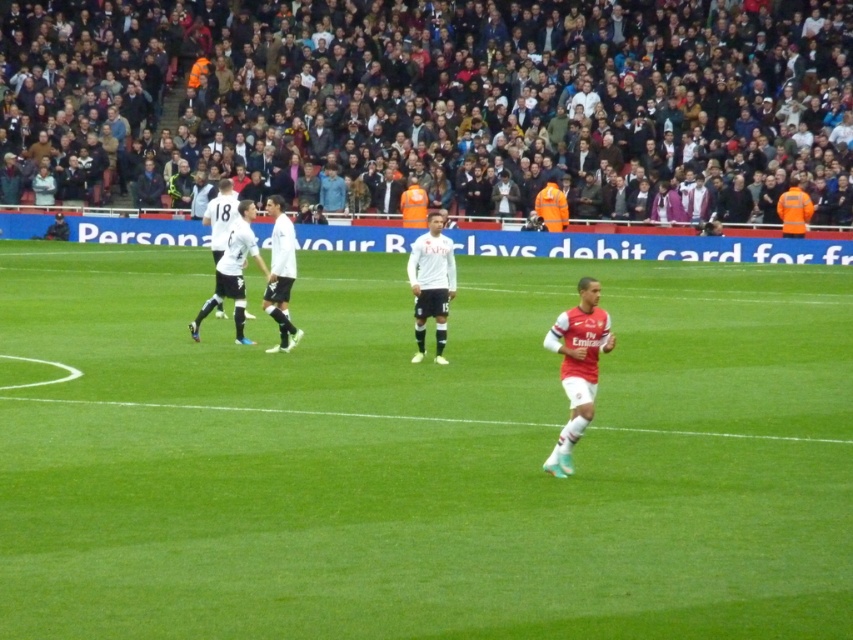
You are a soccer coach analyzing the players on the field. You notice the white matte soccer player at center and the white matte jersey at center. Which object is wider?

The white matte jersey at center is wider than the white matte soccer player at center.